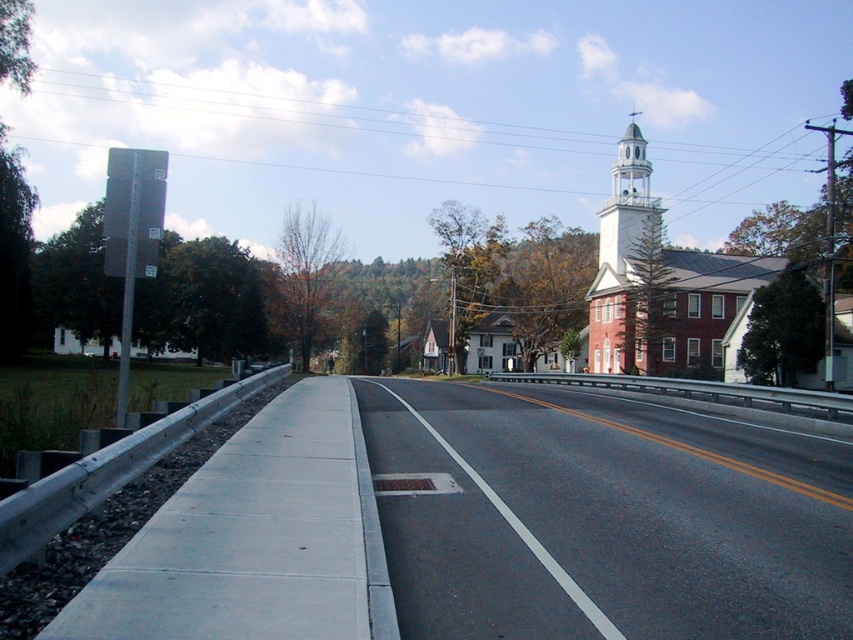
Question: Does asphalt road at center have a smaller size compared to white stucco bell tower at upper right?

Choices:
 (A) yes
 (B) no

Answer: (A)

Question: Which object is closer to the camera taking this photo?

Choices:
 (A) asphalt road at center
 (B) white stucco bell tower at upper right

Answer: (A)

Question: Which object is farther from the camera taking this photo?

Choices:
 (A) white stucco bell tower at upper right
 (B) asphalt road at center

Answer: (A)

Question: Is asphalt road at center positioned before white stucco bell tower at upper right?

Choices:
 (A) yes
 (B) no

Answer: (A)

Question: Can you confirm if asphalt road at center is positioned above white stucco bell tower at upper right?

Choices:
 (A) no
 (B) yes

Answer: (A)